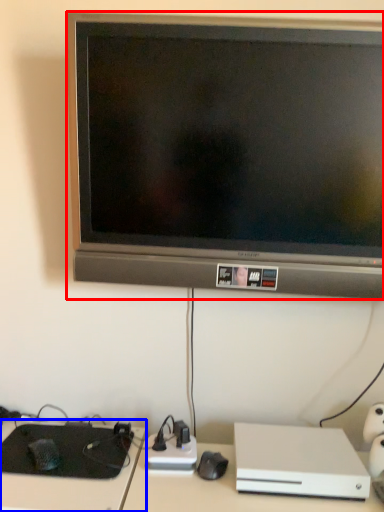
Question: Which object is further to the camera taking this photo, television (highlighted by a red box) or computer desk (highlighted by a blue box)?

Choices:
 (A) television
 (B) computer desk

Answer: (B)